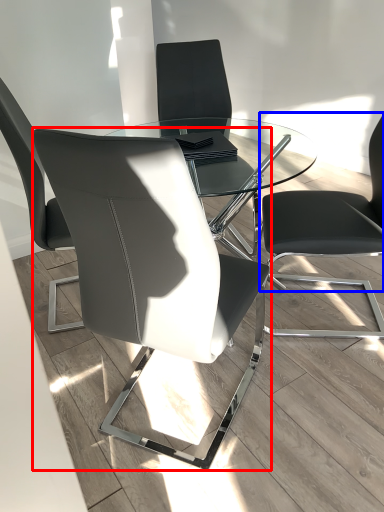
Question: Among these objects, which one is nearest to the camera, chair (highlighted by a red box) or chair (highlighted by a blue box)?

Choices:
 (A) chair
 (B) chair

Answer: (A)